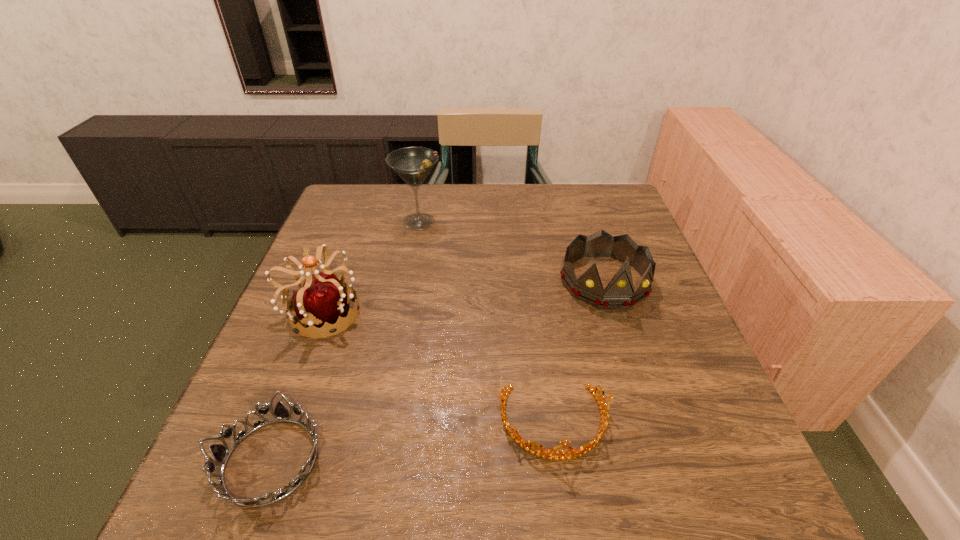
Locate an element on the screen. object that is the third closest one to the third object from right to left is located at coordinates (544, 453).

This screenshot has width=960, height=540. In order to click on tiara identified as the closest to the martini in this screenshot , I will do `click(323, 299)`.

Identify the location of tiara object that ranks as the third closest to the shortest tiara. (619, 293).

This screenshot has width=960, height=540. In order to click on vacant space that satisfies the following two spatial constraints: 1. on the front side of the third object from right to left; 2. on the front-facing side of the tallest tiara in this screenshot , I will do `click(402, 313)`.

Find the location of a particular element. The width and height of the screenshot is (960, 540). vacant region that satisfies the following two spatial constraints: 1. at the front of the third shortest tiara with jewels; 2. on the front-facing side of the fourth shortest object is located at coordinates (614, 313).